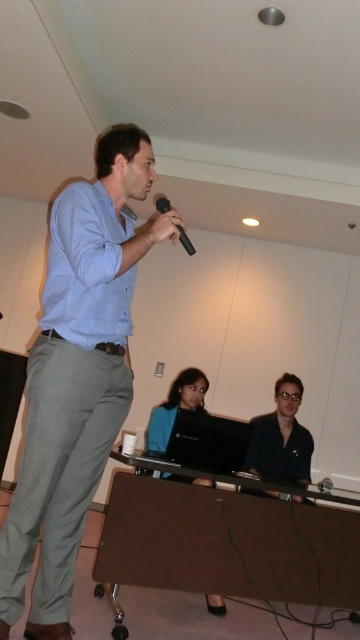
You are a stagehand who needs to place a 20 inch wide decorative panel between the black glossy shirt at center and blue fabric shirt at center. Can you fit it there?

The distance between the black glossy shirt at center and blue fabric shirt at center is 21.41 inches, so the 20 inch wide decorative panel can fit between them with some space remaining.

You are an event organizer and need to ensure that the speaker is visible to all attendees. The speaker is wearing a matte blue shirt at center and a blue fabric shirt at center. Which shirt is covering the other one?

The matte blue shirt at center is positioned over blue fabric shirt at center, so the matte blue shirt is covering the blue fabric shirt.